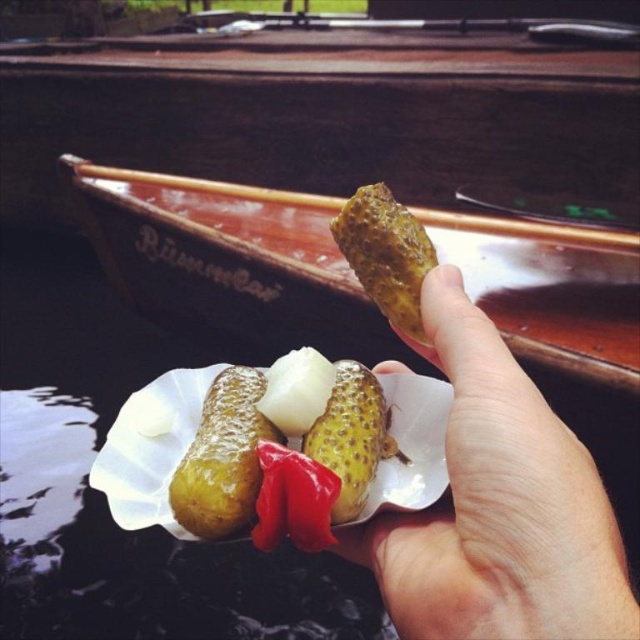
Question: In this image, where is yellow matte paper plate at center located relative to slightly yellowish matte pickle at upper center?

Choices:
 (A) left
 (B) right

Answer: (A)

Question: Which of the following is the closest to the observer?

Choices:
 (A) (419, 268)
 (B) (422, 212)

Answer: (A)

Question: Considering the real-world distances, which object is closest to the wooden boat at center?

Choices:
 (A) translucent white pickles at center
 (B) smooth skin hand at center
 (C) yellow speckled pickle at center
 (D) slightly yellowish matte pickle at upper center

Answer: (D)

Question: Which point is closer to the camera?

Choices:
 (A) yellow matte paper plate at center
 (B) wooden boat at center
 (C) smooth skin hand at center

Answer: (C)

Question: Is yellow matte paper plate at center smaller than slightly yellowish matte pickle at upper center?

Choices:
 (A) yes
 (B) no

Answer: (B)

Question: Does shiny golden pickle at center have a larger size compared to slightly yellowish matte pickle at upper center?

Choices:
 (A) no
 (B) yes

Answer: (B)